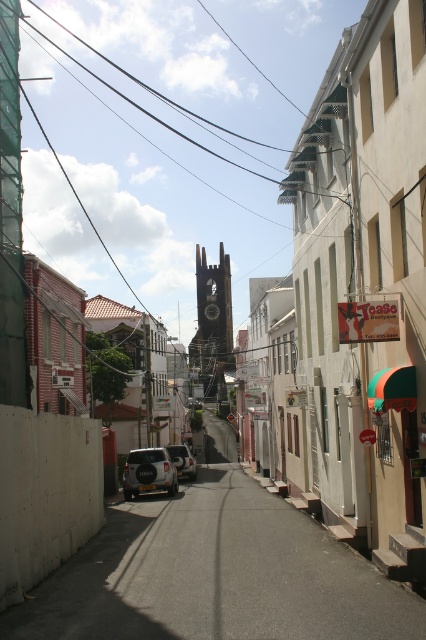
Is smooth asphalt road at center behind dark gray stone spire at center?

No.

Can you confirm if smooth asphalt road at center is taller than dark gray stone spire at center?

Incorrect, smooth asphalt road at center's height is not larger of dark gray stone spire at center's.

Which is behind, point (224, 472) or point (221, 257)?

Point (221, 257)

Find the location of a particular element. The width and height of the screenshot is (426, 640). smooth asphalt road at center is located at coordinates (215, 573).

Based on the photo, can you confirm if white matte suv at center is positioned to the left of white matte car at center?

Yes, white matte suv at center is to the left of white matte car at center.

Describe the element at coordinates (149, 472) in the screenshot. I see `white matte suv at center` at that location.

You are a GUI agent. You are given a task and a screenshot of the screen. Output one action in this format:
    pyautogui.click(x=<x>, y=<y>)
    Task: Click on the white matte suv at center
    This screenshot has width=426, height=640.
    Given the screenshot: What is the action you would take?
    pyautogui.click(x=149, y=472)

Identify the location of white matte suv at center. The image size is (426, 640). (149, 472).

Is the position of dark gray stone spire at center more distant than that of white matte car at center?

That is True.

Consider the image. Is dark gray stone spire at center below white matte car at center?

No.

Between point (204, 300) and point (183, 445), which one is positioned in front?

Point (183, 445) is in front.

The height and width of the screenshot is (640, 426). I want to click on dark gray stone spire at center, so click(x=213, y=314).